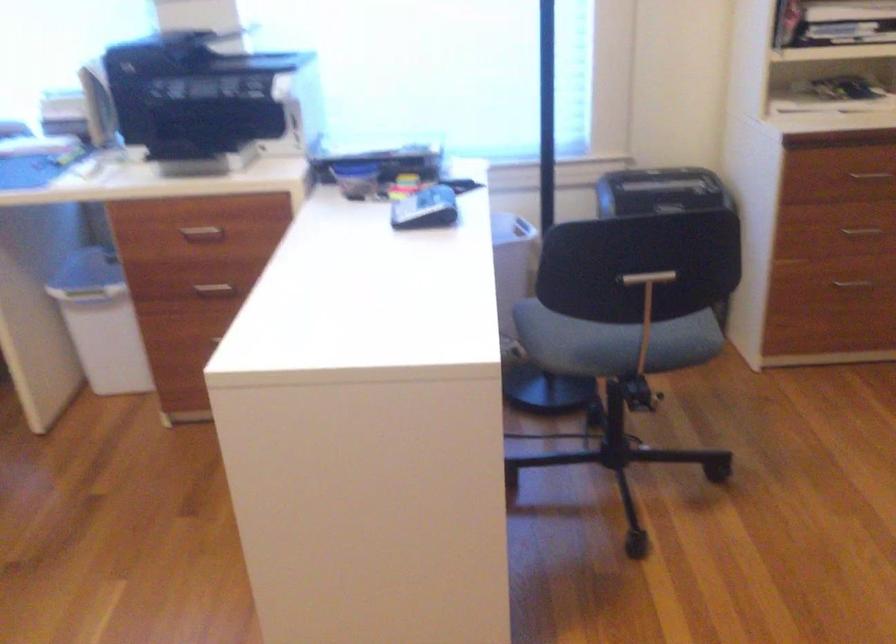
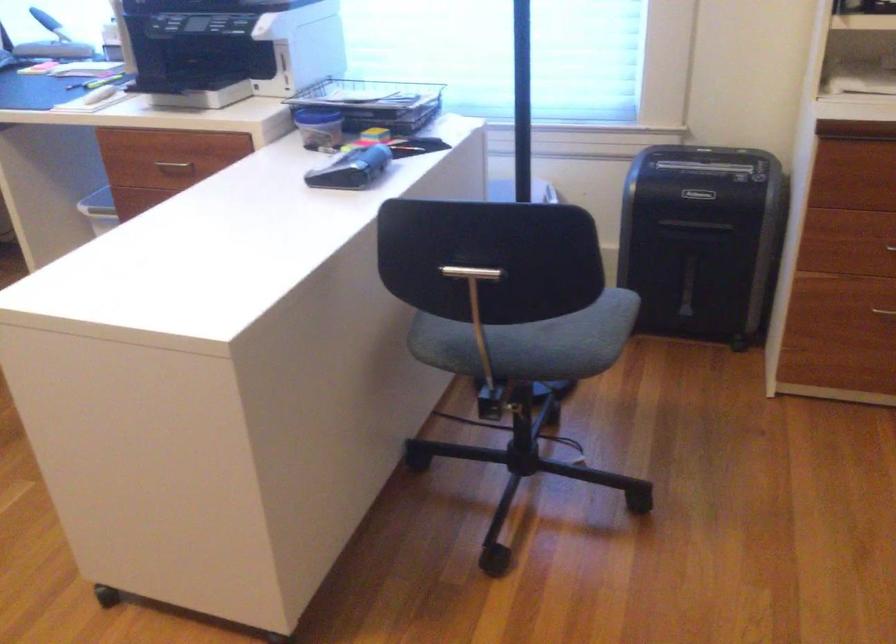
Question: How did the camera likely rotate?

Choices:
 (A) Left
 (B) Right
 (C) Up
 (D) Down

Answer: (A)